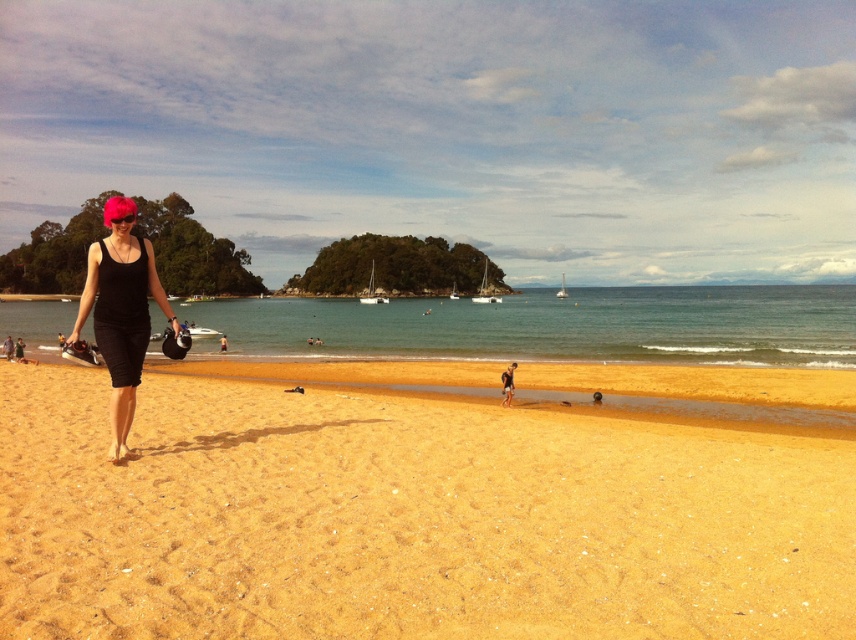
Question: Is golden sand at lower left to the left of black fabric person at left from the viewer's perspective?

Choices:
 (A) no
 (B) yes

Answer: (A)

Question: Can you confirm if clear blue water at center is bigger than light brown sand at lower center?

Choices:
 (A) no
 (B) yes

Answer: (B)

Question: Does black matte swimsuit at left appear under black fabric person at left?

Choices:
 (A) no
 (B) yes

Answer: (A)

Question: Considering the real-world distances, which object is closest to the golden sand at lower left?

Choices:
 (A) black matte swimsuit at left
 (B) light brown sand at lower center

Answer: (B)

Question: Which object is farther from the camera taking this photo?

Choices:
 (A) black fabric person at left
 (B) light brown sand at lower center
 (C) clear blue water at center

Answer: (A)

Question: Which point is closer to the camera taking this photo?

Choices:
 (A) (510, 340)
 (B) (504, 401)
 (C) (223, 336)

Answer: (B)